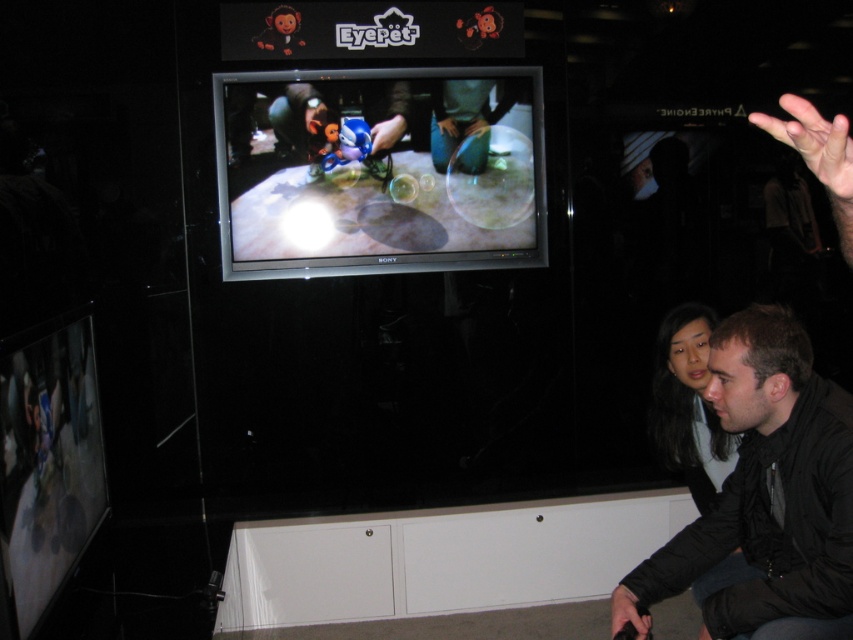
Measure the distance between shiny silver tv at center and dark brown hair at lower right.

They are 96.37 centimeters apart.

Is shiny silver tv at center taller than dark brown hair at lower right?

Yes, shiny silver tv at center is taller than dark brown hair at lower right.

Does point (386, 230) lie behind point (672, 406)?

That is True.

Locate an element on the screen. Image resolution: width=853 pixels, height=640 pixels. shiny silver tv at center is located at coordinates (379, 170).

Is point (733, 538) positioned before point (724, 465)?

Yes, point (733, 538) is closer to viewer.

Which of these two, black matte jacket at lower right or dark brown hair at lower right, stands shorter?

With less height is dark brown hair at lower right.

Does point (804, 480) come farther from viewer compared to point (703, 420)?

No, it is not.

Identify the location of black matte jacket at lower right. The width and height of the screenshot is (853, 640). (764, 497).

Between shiny silver tv at center and black matte jacket at lower right, which one is positioned lower?

Positioned lower is black matte jacket at lower right.

Is point (223, 266) farther from camera compared to point (753, 451)?

Yes, it is behind point (753, 451).

Locate an element on the screen. The image size is (853, 640). shiny silver tv at center is located at coordinates (379, 170).

Find the location of a particular element. shiny silver tv at center is located at coordinates (379, 170).